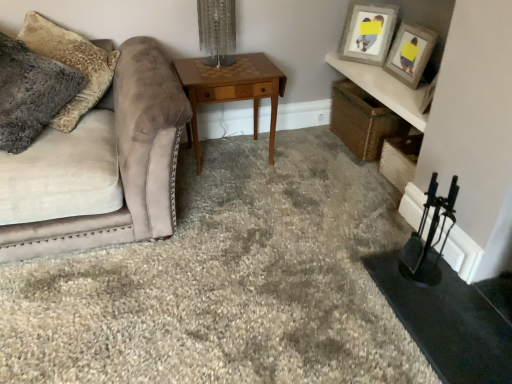
Find the location of `vacant area located to the right-hand side of clear glass table lamp at center`. vacant area located to the right-hand side of clear glass table lamp at center is located at coordinates [x=256, y=72].